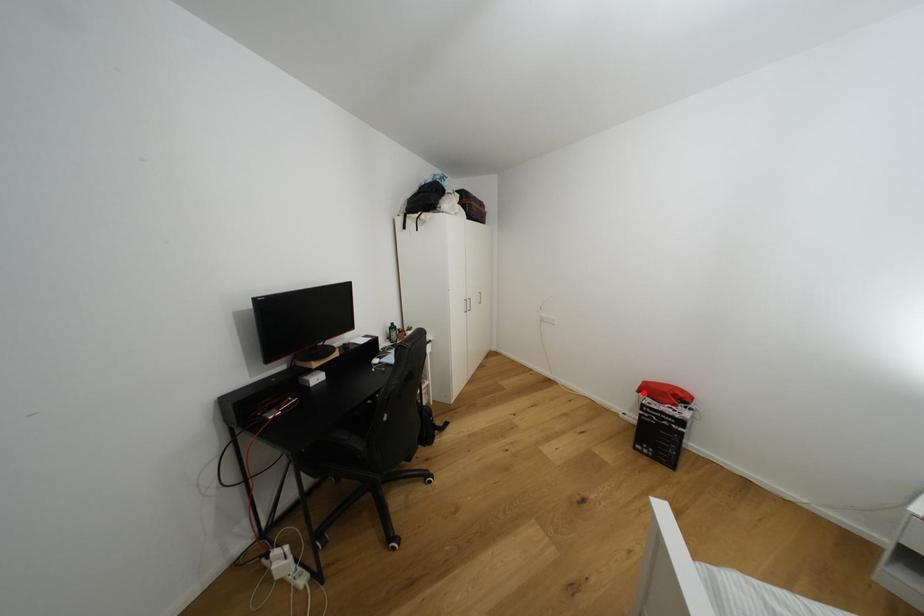
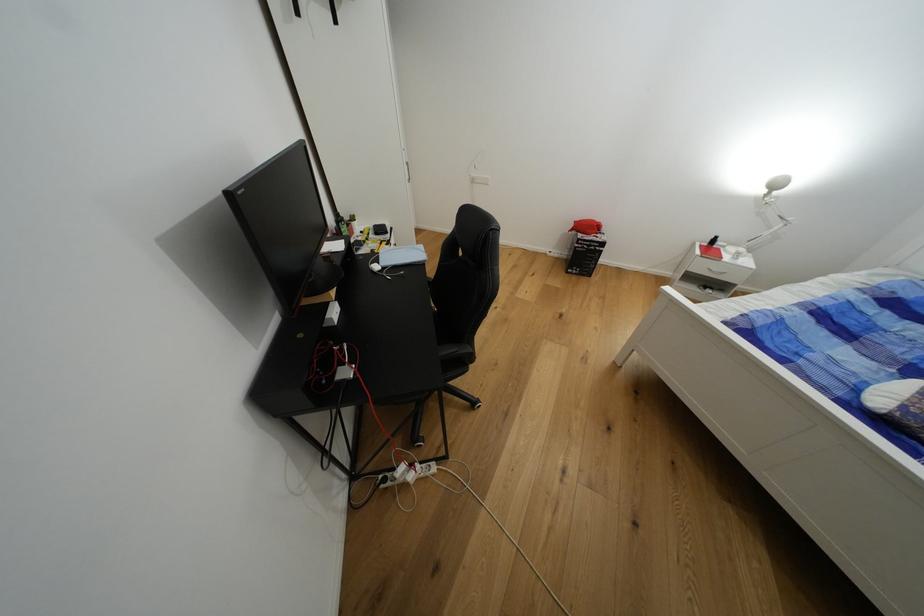
In the second image, find the point that corresponds to the highlighted location in the first image.

(576, 232)